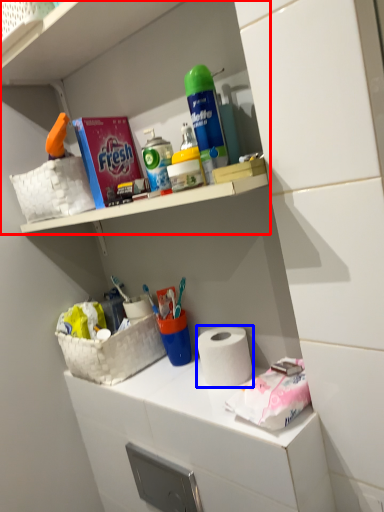
Question: Which object is further to the camera taking this photo, shelf (highlighted by a red box) or paper towel (highlighted by a blue box)?

Choices:
 (A) shelf
 (B) paper towel

Answer: (B)